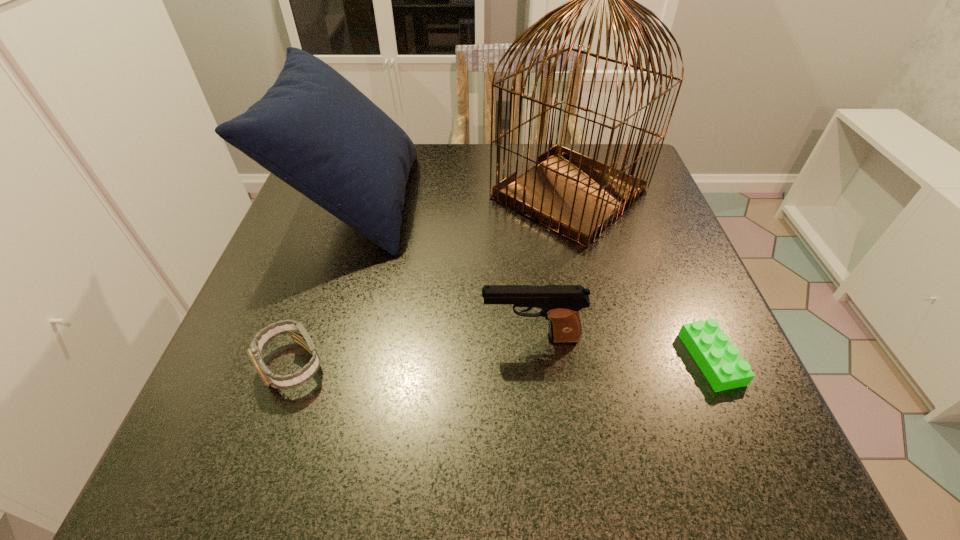
Locate an element on the screen. The width and height of the screenshot is (960, 540). birdcage is located at coordinates (576, 196).

In order to click on cushion in this screenshot , I will do (313, 129).

The width and height of the screenshot is (960, 540). What are the coordinates of `pistol` in the screenshot? It's located at (560, 304).

Where is `watch`? This screenshot has width=960, height=540. watch is located at coordinates (299, 335).

Where is `Lego`? The image size is (960, 540). Lego is located at coordinates (720, 362).

Where is `vacant space situated on the left of the birdcage`? vacant space situated on the left of the birdcage is located at coordinates (450, 195).

Where is `free spot located 0.070m on the facing side of the fourth shortest object`? free spot located 0.070m on the facing side of the fourth shortest object is located at coordinates (443, 201).

Image resolution: width=960 pixels, height=540 pixels. What are the coordinates of `free region located 0.290m at the barrel of the pistol` in the screenshot? It's located at (307, 338).

Identify the location of free space located 0.150m at the barrel of the pistol. This screenshot has width=960, height=540. (392, 338).

Locate an element on the screen. This screenshot has width=960, height=540. free spot located at the barrel of the pistol is located at coordinates (355, 338).